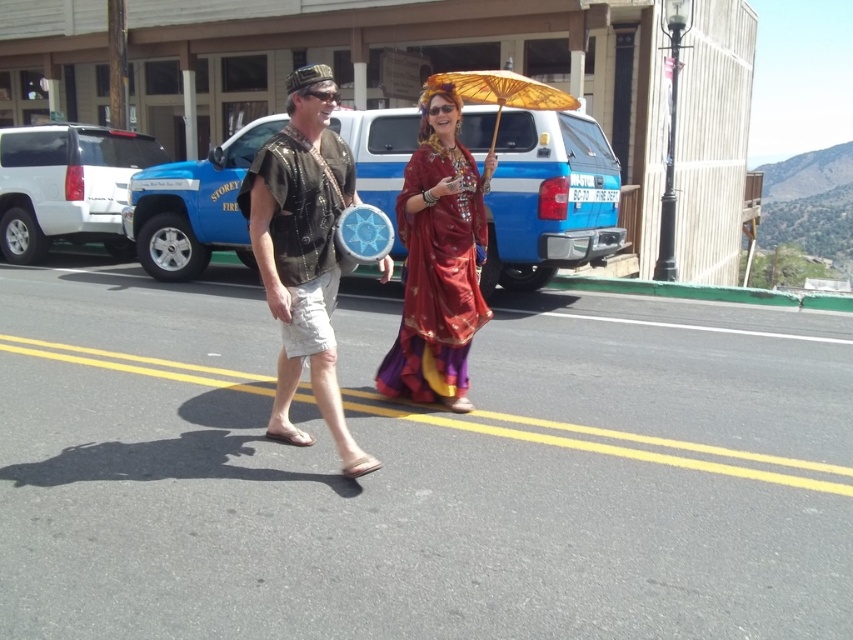
Question: Is white matte suv at left closer to the viewer compared to wooden parasol at center?

Choices:
 (A) yes
 (B) no

Answer: (B)

Question: Based on their relative distances, which object is nearer to the white matte suv at left?

Choices:
 (A) wooden parasol at center
 (B) camouflage fabric vest at center
 (C) blue metallic truck at center

Answer: (A)

Question: Can you confirm if white matte suv at left is positioned above wooden parasol at center?

Choices:
 (A) no
 (B) yes

Answer: (A)

Question: Which is nearer to the camouflage fabric vest at center?

Choices:
 (A) wooden parasol at center
 (B) white matte suv at left
 (C) shiny red fabric dress at center

Answer: (C)

Question: Which object appears farthest from the camera in this image?

Choices:
 (A) white matte suv at left
 (B) blue metallic truck at center
 (C) shiny red fabric dress at center

Answer: (A)

Question: Is camouflage fabric vest at center bigger than shiny red fabric dress at center?

Choices:
 (A) no
 (B) yes

Answer: (B)